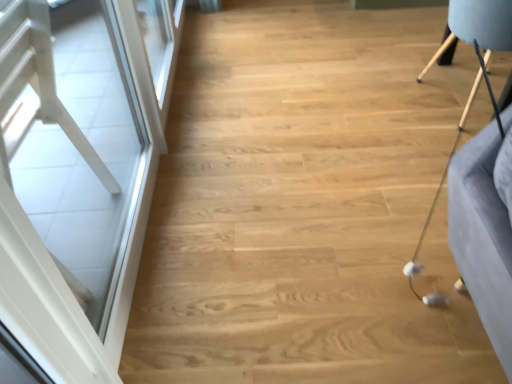
Question: From their relative heights in the image, would you say white glossy screen door at left is taller or shorter than light brown wooden chair at upper right?

Choices:
 (A) short
 (B) tall

Answer: (B)

Question: Is white glossy screen door at left situated inside light brown wooden chair at upper right or outside?

Choices:
 (A) inside
 (B) outside

Answer: (B)

Question: Relative to light brown wooden chair at upper right, is white glossy screen door at left in front or behind?

Choices:
 (A) front
 (B) behind

Answer: (A)

Question: From the image's perspective, is light brown wooden chair at upper right positioned above or below white glossy screen door at left?

Choices:
 (A) above
 (B) below

Answer: (A)

Question: Is light brown wooden chair at upper right in front of or behind white glossy screen door at left in the image?

Choices:
 (A) behind
 (B) front

Answer: (A)

Question: Does point (437, 56) appear closer or farther from the camera than point (89, 311)?

Choices:
 (A) closer
 (B) farther

Answer: (B)

Question: Based on their sizes in the image, would you say light brown wooden chair at upper right is bigger or smaller than white glossy screen door at left?

Choices:
 (A) small
 (B) big

Answer: (B)